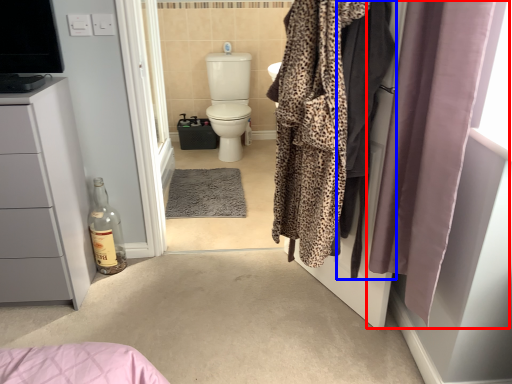
Question: Which of the following is the farthest to the observer, curtain (highlighted by a red box) or clothing (highlighted by a blue box)?

Choices:
 (A) curtain
 (B) clothing

Answer: (B)